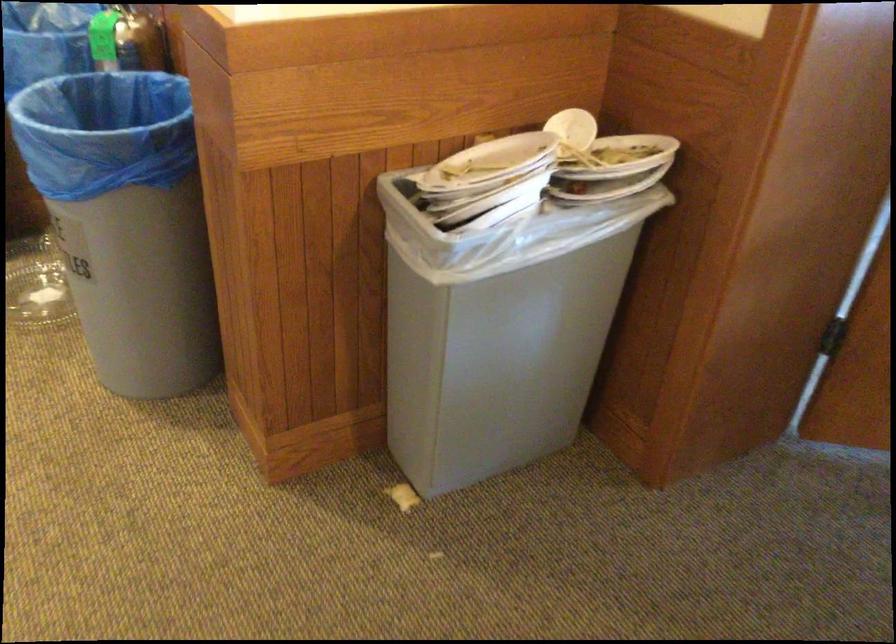
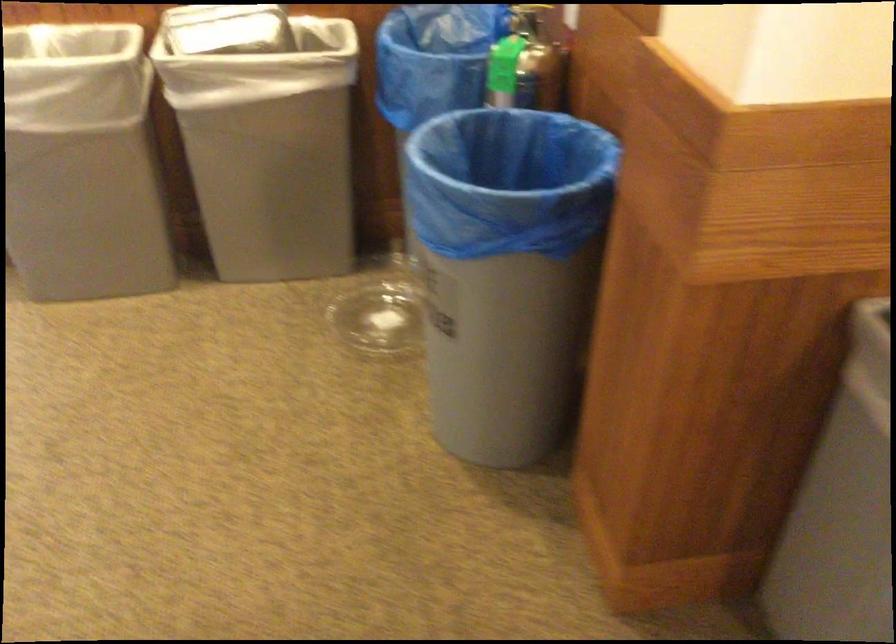
The images are taken continuously from a first-person perspective. In which direction are you moving?

The movement direction of the cameraman is left, forward.